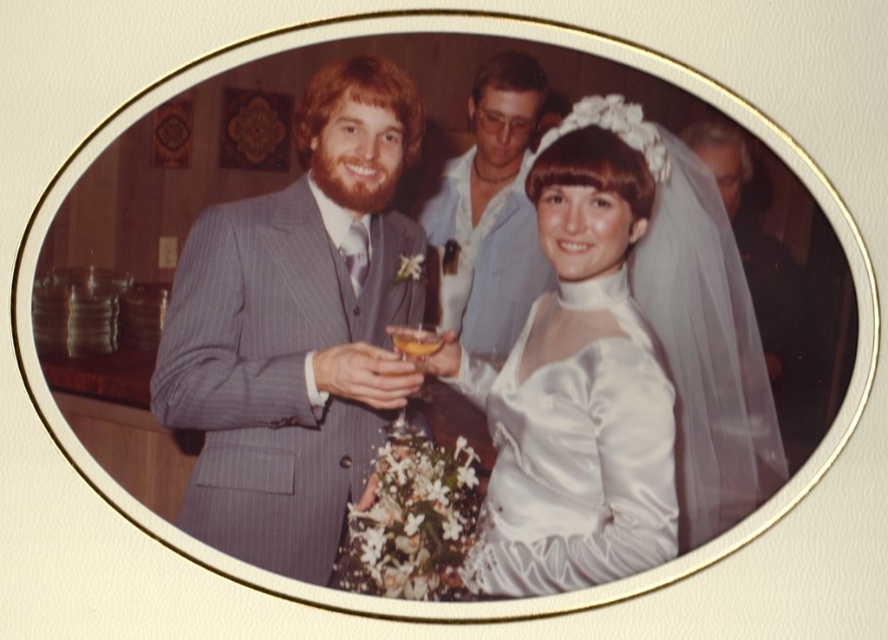
Can you confirm if satin white dress at center is positioned above light blue shirt at center?

No.

From the picture: Can you confirm if satin white dress at center is positioned to the right of light blue shirt at center?

Yes, satin white dress at center is to the right of light blue shirt at center.

This screenshot has width=888, height=640. Describe the element at coordinates (575, 456) in the screenshot. I see `satin white dress at center` at that location.

I want to click on satin white dress at center, so click(x=575, y=456).

Where is `translucent glass wine glass at center`? translucent glass wine glass at center is located at coordinates (415, 342).

The height and width of the screenshot is (640, 888). Describe the element at coordinates (415, 342) in the screenshot. I see `translucent glass wine glass at center` at that location.

Where is `translucent glass wine glass at center`? translucent glass wine glass at center is located at coordinates (415, 342).

Does light blue shirt at center have a larger size compared to translucent glass wine glass at center?

Indeed, light blue shirt at center has a larger size compared to translucent glass wine glass at center.

Does light blue shirt at center appear over translucent glass wine glass at center?

Yes, light blue shirt at center is above translucent glass wine glass at center.

Which is behind, point (537, 120) or point (435, 346)?

The point (435, 346) is behind.

At what (x,y) coordinates should I click in order to perform the action: click on light blue shirt at center. Please return your answer as a coordinate pair (x, y). This screenshot has width=888, height=640. Looking at the image, I should click on (493, 204).